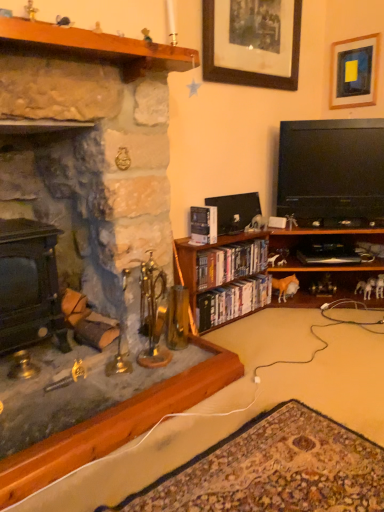
Question: Considering the relative positions of wooden at left and black glossy flat-screen tv at right in the image provided, is wooden at left in front of black glossy flat-screen tv at right?

Choices:
 (A) yes
 (B) no

Answer: (A)

Question: Is wooden at left looking in the opposite direction of black glossy flat-screen tv at right?

Choices:
 (A) no
 (B) yes

Answer: (A)

Question: Is wooden at left placed right next to black glossy flat-screen tv at right?

Choices:
 (A) yes
 (B) no

Answer: (B)

Question: From a real-world perspective, is wooden at left positioned over black glossy flat-screen tv at right based on gravity?

Choices:
 (A) yes
 (B) no

Answer: (A)

Question: From the image's perspective, is wooden at left over black glossy flat-screen tv at right?

Choices:
 (A) no
 (B) yes

Answer: (B)

Question: Is hardcover book at center, the third book ordered from the bottom, in front of or behind wooden picture frame at upper center, the second picture frame from the right, in the image?

Choices:
 (A) behind
 (B) front

Answer: (A)

Question: From a real-world perspective, is hardcover book at center, which is the 1th book in top-to-bottom order, physically located above or below wooden picture frame at upper center, placed as the first picture frame when sorted from left to right?

Choices:
 (A) below
 (B) above

Answer: (A)

Question: In the image, is hardcover book at center, which is the 1th book in top-to-bottom order, on the left side or the right side of wooden picture frame at upper center, placed as the first picture frame when sorted from left to right?

Choices:
 (A) right
 (B) left

Answer: (B)

Question: Based on their sizes in the image, would you say hardcover book at center, which is the 1th book in top-to-bottom order, is bigger or smaller than wooden picture frame at upper center, placed as the first picture frame when sorted from left to right?

Choices:
 (A) small
 (B) big

Answer: (A)

Question: In terms of width, does wooden picture frame at upper right, which is counted as the first picture frame, starting from the right, look wider or thinner when compared to hardcover book at center, the third book ordered from the bottom?

Choices:
 (A) wide
 (B) thin

Answer: (B)

Question: Based on their sizes in the image, would you say wooden picture frame at upper right, which is counted as the first picture frame, starting from the right, is bigger or smaller than hardcover book at center, which is the 1th book in top-to-bottom order?

Choices:
 (A) big
 (B) small

Answer: (A)

Question: From the image's perspective, is wooden picture frame at upper right, the 2th picture frame positioned from the left, above or below hardcover book at center, which is the 1th book in top-to-bottom order?

Choices:
 (A) below
 (B) above

Answer: (B)

Question: Considering the positions of point (375, 44) and point (211, 231), is point (375, 44) closer or farther from the camera than point (211, 231)?

Choices:
 (A) farther
 (B) closer

Answer: (A)

Question: Considering their positions, is black glossy flat-screen tv at right located in front of or behind wooden bookshelf at lower center?

Choices:
 (A) front
 (B) behind

Answer: (B)

Question: Is black glossy flat-screen tv at right wider or thinner than wooden bookshelf at lower center?

Choices:
 (A) wide
 (B) thin

Answer: (B)